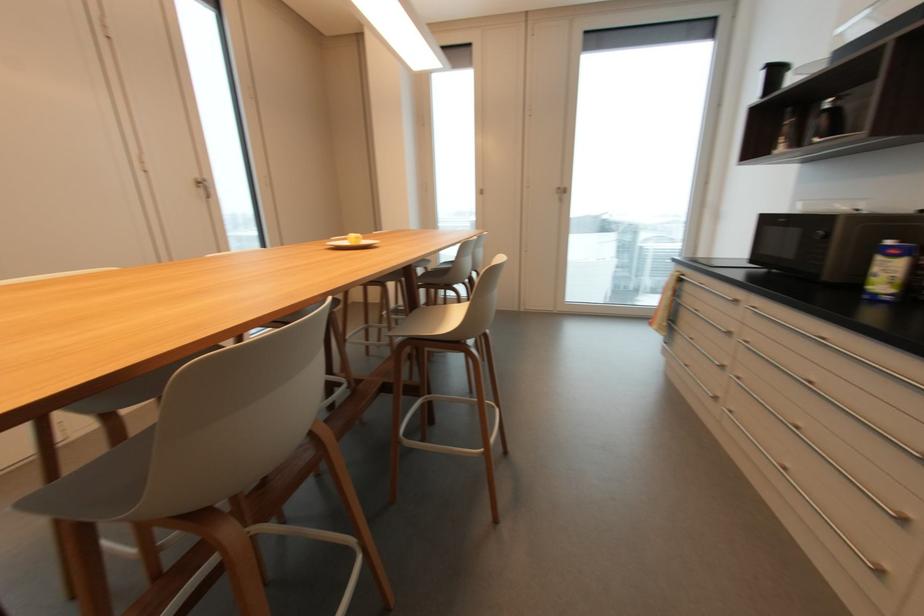
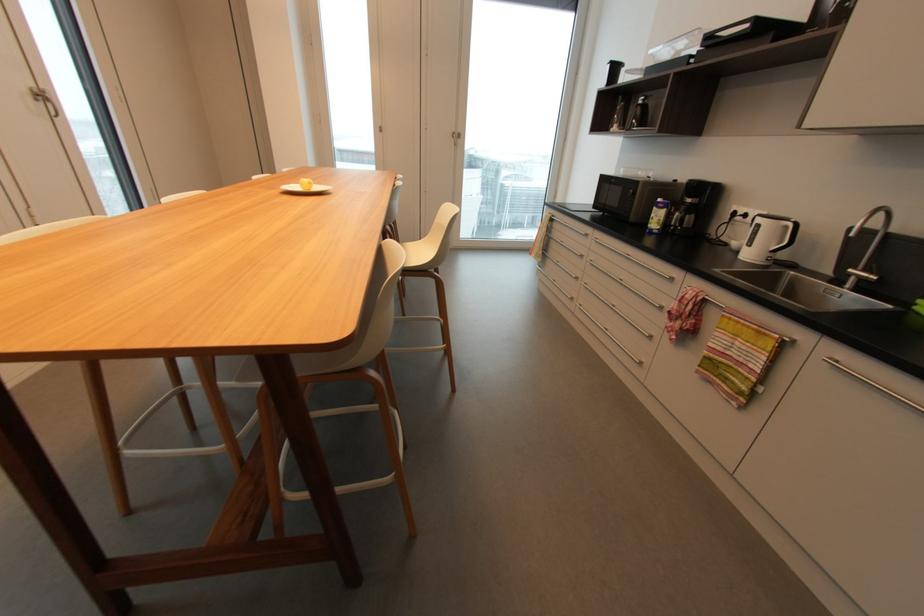
Locate, in the second image, the point that corresponds to the point at 895,243 in the first image.

(663, 200)